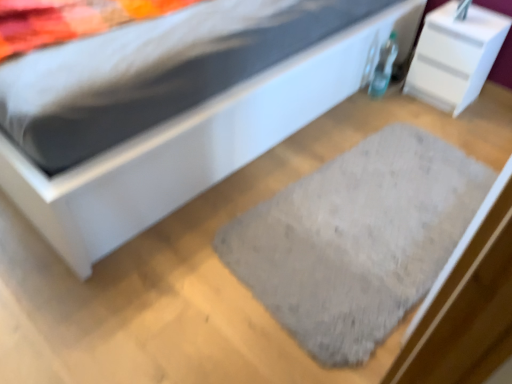
Describe the element at coordinates (357, 239) in the screenshot. I see `gray fuzzy rug at center` at that location.

At what (x,y) coordinates should I click in order to perform the action: click on white matte bed at center. Please return your answer as a coordinate pair (x, y). Looking at the image, I should click on (194, 145).

I want to click on white glossy nightstand at upper right, so click(455, 56).

From a real-world perspective, is gray fuzzy rug at center physically above white glossy nightstand at upper right?

No, from a real-world perspective, gray fuzzy rug at center is not over white glossy nightstand at upper right

Which point is more forward, [432,232] or [469,77]?

The point [432,232] is in front.

Is gray fuzzy rug at center aimed at white glossy nightstand at upper right?

No.

From the image's perspective, is gray fuzzy rug at center under white glossy nightstand at upper right?

Yes, from the image's perspective, gray fuzzy rug at center is beneath white glossy nightstand at upper right.

From the image's perspective, which object appears higher, white matte bed at center or gray fuzzy rug at center?

white matte bed at center appears higher in the image.

Based on the photo, considering the relative sizes of white matte bed at center and gray fuzzy rug at center in the image provided, is white matte bed at center shorter than gray fuzzy rug at center?

Incorrect, the height of white matte bed at center does not fall short of that of gray fuzzy rug at center.

In terms of width, does white matte bed at center look wider or thinner when compared to gray fuzzy rug at center?

Considering their sizes, white matte bed at center looks broader than gray fuzzy rug at center.

Is white glossy nightstand at upper right thinner than gray fuzzy rug at center?

Correct, the width of white glossy nightstand at upper right is less than that of gray fuzzy rug at center.

Is white glossy nightstand at upper right spatially inside gray fuzzy rug at center, or outside of it?

white glossy nightstand at upper right is located beyond the bounds of gray fuzzy rug at center.

Considering the sizes of objects white glossy nightstand at upper right and gray fuzzy rug at center in the image provided, who is smaller, white glossy nightstand at upper right or gray fuzzy rug at center?

Smaller between the two is gray fuzzy rug at center.

Is white glossy nightstand at upper right positioned with its back to gray fuzzy rug at center?

That's not correct — white glossy nightstand at upper right is not looking away from gray fuzzy rug at center.

The width and height of the screenshot is (512, 384). I want to click on doormat to the right of white matte bed at center, so click(x=357, y=239).

Considering the positions of objects gray fuzzy rug at center and white matte bed at center in the image provided, who is more to the right, gray fuzzy rug at center or white matte bed at center?

Positioned to the right is gray fuzzy rug at center.

How different are the orientations of gray fuzzy rug at center and white matte bed at center in degrees?

There is a 176-degree angle between the facing directions of gray fuzzy rug at center and white matte bed at center.

Considering the points (413, 128) and (142, 204), which point is in front, point (413, 128) or point (142, 204)?

Point (142, 204)

Is white matte bed at center at the back of white glossy nightstand at upper right?

white glossy nightstand at upper right is not turned away from white matte bed at center.

At what (x,y) coordinates should I click in order to perform the action: click on bed located below the white glossy nightstand at upper right (from the image's perspective). Please return your answer as a coordinate pair (x, y). This screenshot has width=512, height=384. Looking at the image, I should click on (194, 145).

Looking at the image, does white matte bed at center seem bigger or smaller compared to white glossy nightstand at upper right?

Considering their sizes, white matte bed at center takes up more space than white glossy nightstand at upper right.

From the image's perspective, between white matte bed at center and white glossy nightstand at upper right, which one is located above?

From the image's view, white glossy nightstand at upper right is above.

How different are the orientations of white matte bed at center and white glossy nightstand at upper right in degrees?

The facing directions of white matte bed at center and white glossy nightstand at upper right are 89 degrees apart.

Does point (306, 55) lie in front of point (424, 94)?

Yes.

This screenshot has height=384, width=512. In the image, there is a gray fuzzy rug at center. Identify the location of nightstand above it (from the image's perspective). (455, 56).

Identify the location of bed lying on the left of gray fuzzy rug at center. (194, 145).

Which object lies further to the anchor point white matte bed at center, white glossy nightstand at upper right or gray fuzzy rug at center?

Based on the image, white glossy nightstand at upper right appears to be further to white matte bed at center.

Considering their positions, is gray fuzzy rug at center positioned closer to white matte bed at center than white glossy nightstand at upper right?

gray fuzzy rug at center.

Based on the photo, looking at the image, which one is located closer to white glossy nightstand at upper right, gray fuzzy rug at center or white matte bed at center?

white matte bed at center lies closer to white glossy nightstand at upper right than the other object.

Based on their spatial positions, is white glossy nightstand at upper right or white matte bed at center closer to gray fuzzy rug at center?

Based on the image, white matte bed at center appears to be nearer to gray fuzzy rug at center.

Considering their positions, is white matte bed at center positioned closer to gray fuzzy rug at center than white glossy nightstand at upper right?

The object closer to gray fuzzy rug at center is white matte bed at center.

Considering their positions, is white matte bed at center positioned further to white glossy nightstand at upper right than gray fuzzy rug at center?

gray fuzzy rug at center is positioned further to the anchor white glossy nightstand at upper right.

Locate an element on the screen. doormat between white matte bed at center and white glossy nightstand at upper right from front to back is located at coordinates (357, 239).